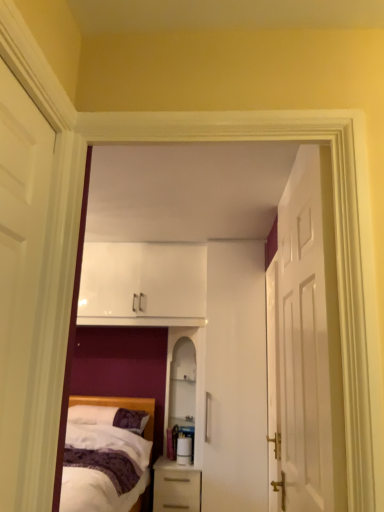
Question: Is white glossy door at right, arranged as the 1th door when viewed from the right, directly adjacent to purple soft pillow at lower left?

Choices:
 (A) yes
 (B) no

Answer: (B)

Question: Can you confirm if white glossy door at right, arranged as the 1th door when viewed from the right, is wider than purple soft pillow at lower left?

Choices:
 (A) no
 (B) yes

Answer: (A)

Question: Is white glossy door at right, arranged as the 1th door when viewed from the right, positioned behind purple soft pillow at lower left?

Choices:
 (A) no
 (B) yes

Answer: (A)

Question: Is white glossy door at right, the 3th door when ordered from left to right, aimed at purple soft pillow at lower left?

Choices:
 (A) yes
 (B) no

Answer: (A)

Question: Can you confirm if white glossy door at right, the 3th door when ordered from left to right, is smaller than purple soft pillow at lower left?

Choices:
 (A) no
 (B) yes

Answer: (A)

Question: Can you confirm if white glossy door at right, arranged as the 1th door when viewed from the right, is taller than purple soft pillow at lower left?

Choices:
 (A) no
 (B) yes

Answer: (B)

Question: Is white wooden door at right, which is counted as the second door, starting from the left, bigger than white matte door at left, positioned as the 1th door in left-to-right order?

Choices:
 (A) no
 (B) yes

Answer: (B)

Question: From the image's perspective, is white wooden door at right, which is counted as the second door, starting from the left, on top of white matte door at left, positioned as the 1th door in left-to-right order?

Choices:
 (A) yes
 (B) no

Answer: (B)

Question: Considering the relative sizes of white wooden door at right, marked as the 2th door in a right-to-left arrangement, and white matte door at left, positioned as the 1th door in left-to-right order, in the image provided, is white wooden door at right, marked as the 2th door in a right-to-left arrangement, wider than white matte door at left, positioned as the 1th door in left-to-right order,?

Choices:
 (A) no
 (B) yes

Answer: (B)

Question: Does white wooden door at right, which is counted as the second door, starting from the left, have a lesser width compared to white matte door at left, which ranks as the 3th door in right-to-left order?

Choices:
 (A) yes
 (B) no

Answer: (B)

Question: Is white wooden door at right, marked as the 2th door in a right-to-left arrangement, with white matte door at left, positioned as the 1th door in left-to-right order?

Choices:
 (A) yes
 (B) no

Answer: (B)

Question: Considering the relative sizes of white wooden door at right, marked as the 2th door in a right-to-left arrangement, and white matte door at left, positioned as the 1th door in left-to-right order, in the image provided, is white wooden door at right, marked as the 2th door in a right-to-left arrangement, shorter than white matte door at left, positioned as the 1th door in left-to-right order,?

Choices:
 (A) yes
 (B) no

Answer: (B)

Question: Is the depth of white glossy door at right, arranged as the 1th door when viewed from the right, greater than that of white matte door at left, which ranks as the 3th door in right-to-left order?

Choices:
 (A) no
 (B) yes

Answer: (B)